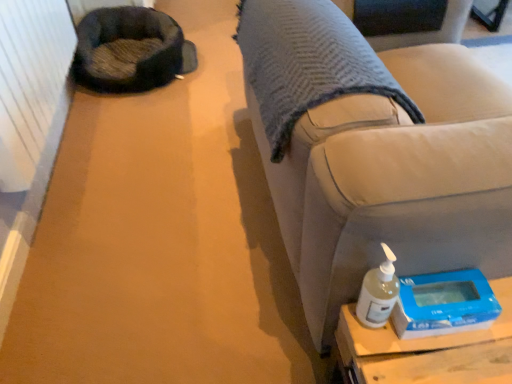
The height and width of the screenshot is (384, 512). In order to click on white matte bottle at lower right in this screenshot , I will do `click(378, 292)`.

What do you see at coordinates (378, 292) in the screenshot? The image size is (512, 384). I see `white matte bottle at lower right` at bounding box center [378, 292].

Describe the element at coordinates (378, 160) in the screenshot. I see `satin beige couch at lower right` at that location.

Where is `dark gray plush bean bag chair at upper left`? This screenshot has height=384, width=512. dark gray plush bean bag chair at upper left is located at coordinates (129, 50).

At what (x,y) coordinates should I click in order to perform the action: click on white matte bottle at lower right. Please return your answer as a coordinate pair (x, y). Looking at the image, I should click on (378, 292).

Considering the positions of objects white matte bottle at lower right and blue plastic scale at lower right in the image provided, who is more to the right, white matte bottle at lower right or blue plastic scale at lower right?

From the viewer's perspective, blue plastic scale at lower right appears more on the right side.

Considering the relative positions of white matte bottle at lower right and blue plastic scale at lower right in the image provided, is white matte bottle at lower right in front of blue plastic scale at lower right?

Yes, it is.

From the image's perspective, relative to blue plastic scale at lower right, is white matte bottle at lower right above or below?

white matte bottle at lower right is above blue plastic scale at lower right.

Where is `scale located on the right of white matte bottle at lower right`? Image resolution: width=512 pixels, height=384 pixels. scale located on the right of white matte bottle at lower right is located at coordinates (444, 304).

From the image's perspective, is satin beige couch at lower right located above or below white matte bottle at lower right?

satin beige couch at lower right is situated higher than white matte bottle at lower right in the image.

From a real-world perspective, is satin beige couch at lower right positioned above or below white matte bottle at lower right?

In terms of real-world spatial position, satin beige couch at lower right is below white matte bottle at lower right.

Looking at their sizes, would you say satin beige couch at lower right is wider or thinner than white matte bottle at lower right?

Clearly, satin beige couch at lower right has more width compared to white matte bottle at lower right.

Looking at this image, between satin beige couch at lower right and white matte bottle at lower right, which one has smaller size?

white matte bottle at lower right.

Is dark gray plush bean bag chair at upper left in front of or behind satin beige couch at lower right in the image?

dark gray plush bean bag chair at upper left is positioned farther from the viewer than satin beige couch at lower right.

Based on the photo, who is taller, dark gray plush bean bag chair at upper left or satin beige couch at lower right?

Standing taller between the two is satin beige couch at lower right.

Can we say dark gray plush bean bag chair at upper left lies outside satin beige couch at lower right?

Indeed, dark gray plush bean bag chair at upper left is completely outside satin beige couch at lower right.

From a real-world perspective, is white matte bottle at lower right positioned under satin beige couch at lower right based on gravity?

No, from a real-world perspective, white matte bottle at lower right is not under satin beige couch at lower right.

Does white matte bottle at lower right turn towards satin beige couch at lower right?

Yes, white matte bottle at lower right faces towards satin beige couch at lower right.

Is satin beige couch at lower right inside white matte bottle at lower right?

Actually, satin beige couch at lower right is outside white matte bottle at lower right.

Is dark gray plush bean bag chair at upper left next to white matte bottle at lower right?

dark gray plush bean bag chair at upper left is not next to white matte bottle at lower right, and they're not touching.

Is white matte bottle at lower right surrounded by dark gray plush bean bag chair at upper left?

Definitely not — white matte bottle at lower right is not inside dark gray plush bean bag chair at upper left.

Based on the photo, how many degrees apart are the facing directions of dark gray plush bean bag chair at upper left and white matte bottle at lower right?

The angular difference between dark gray plush bean bag chair at upper left and white matte bottle at lower right is 85.9 degrees.

Between dark gray plush bean bag chair at upper left and white matte bottle at lower right, which one appears on the right side from the viewer's perspective?

white matte bottle at lower right.

Is satin beige couch at lower right facing away from blue plastic scale at lower right?

No.

Does point (400, 264) appear closer or farther from the camera than point (441, 318)?

Point (400, 264) is farther from the camera than point (441, 318).

From the image's perspective, would you say satin beige couch at lower right is positioned over blue plastic scale at lower right?

Yes, from the image's perspective, satin beige couch at lower right is on top of blue plastic scale at lower right.

Which of these two, blue plastic scale at lower right or white matte bottle at lower right, is bigger?

blue plastic scale at lower right.

Considering the sizes of blue plastic scale at lower right and white matte bottle at lower right in the image, is blue plastic scale at lower right wider or thinner than white matte bottle at lower right?

In the image, blue plastic scale at lower right appears to be wider than white matte bottle at lower right.

At what (x,y) coordinates should I click in order to perform the action: click on scale behind the white matte bottle at lower right. Please return your answer as a coordinate pair (x, y). The height and width of the screenshot is (384, 512). Looking at the image, I should click on (444, 304).

Considering the relative positions of blue plastic scale at lower right and white matte bottle at lower right in the image provided, is blue plastic scale at lower right behind white matte bottle at lower right?

Yes.

Find the location of a particular element. bottle above the blue plastic scale at lower right (from a real-world perspective) is located at coordinates (378, 292).

Where is `bottle on the left of satin beige couch at lower right`? This screenshot has width=512, height=384. bottle on the left of satin beige couch at lower right is located at coordinates (378, 292).

Looking at the image, which one is located closer to dark gray plush bean bag chair at upper left, white matte bottle at lower right or blue plastic scale at lower right?

white matte bottle at lower right.

Which object lies further to the anchor point white matte bottle at lower right, satin beige couch at lower right or dark gray plush bean bag chair at upper left?

dark gray plush bean bag chair at upper left is further to white matte bottle at lower right.

Which object lies further to the anchor point dark gray plush bean bag chair at upper left, satin beige couch at lower right or white matte bottle at lower right?

The object further to dark gray plush bean bag chair at upper left is white matte bottle at lower right.

From the image, which object appears to be nearer to blue plastic scale at lower right, dark gray plush bean bag chair at upper left or white matte bottle at lower right?

white matte bottle at lower right is positioned closer to the anchor blue plastic scale at lower right.

Estimate the real-world distances between objects in this image. Which object is closer to dark gray plush bean bag chair at upper left, blue plastic scale at lower right or white matte bottle at lower right?

Based on the image, white matte bottle at lower right appears to be nearer to dark gray plush bean bag chair at upper left.

Based on their spatial positions, is white matte bottle at lower right or dark gray plush bean bag chair at upper left further from satin beige couch at lower right?

The object further to satin beige couch at lower right is dark gray plush bean bag chair at upper left.

Looking at the image, which one is located further to white matte bottle at lower right, dark gray plush bean bag chair at upper left or satin beige couch at lower right?

Based on the image, dark gray plush bean bag chair at upper left appears to be further to white matte bottle at lower right.

Which object lies further to the anchor point white matte bottle at lower right, blue plastic scale at lower right or satin beige couch at lower right?

Among the two, satin beige couch at lower right is located further to white matte bottle at lower right.

This screenshot has height=384, width=512. In order to click on bottle between satin beige couch at lower right and blue plastic scale at lower right in the vertical direction in this screenshot , I will do `click(378, 292)`.

You are a GUI agent. You are given a task and a screenshot of the screen. Output one action in this format:
    pyautogui.click(x=<x>, y=<y>)
    Task: Click on the scale located between white matte bottle at lower right and dark gray plush bean bag chair at upper left in the depth direction
    This screenshot has width=512, height=384.
    Given the screenshot: What is the action you would take?
    pyautogui.click(x=444, y=304)

Find the location of `scale located between satin beige couch at lower right and dark gray plush bean bag chair at upper left in the depth direction`. scale located between satin beige couch at lower right and dark gray plush bean bag chair at upper left in the depth direction is located at coordinates (444, 304).

Identify the location of bottle located between satin beige couch at lower right and dark gray plush bean bag chair at upper left in the depth direction. This screenshot has width=512, height=384. (378, 292).